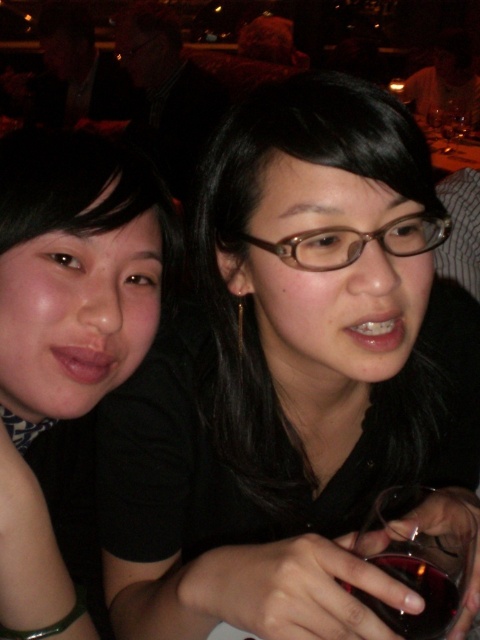
You are a photographer at a social event and want to capture a candid shot of the two people. You notice the black matte hair at center and the transparent glass at lower right. Which object is positioned higher in the image?

The black matte hair at center is located above transparent glass at lower right, so the black matte hair at center is positioned higher in the image.